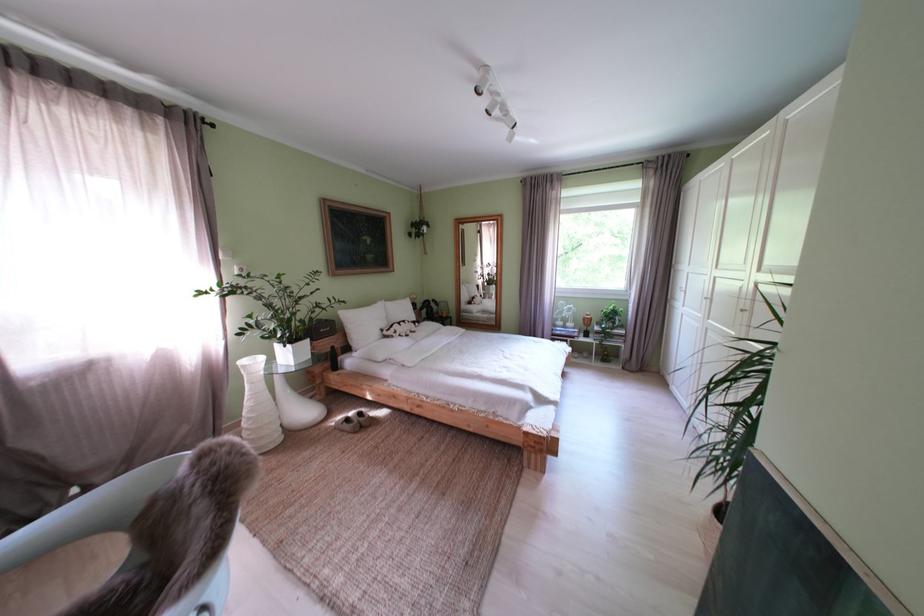
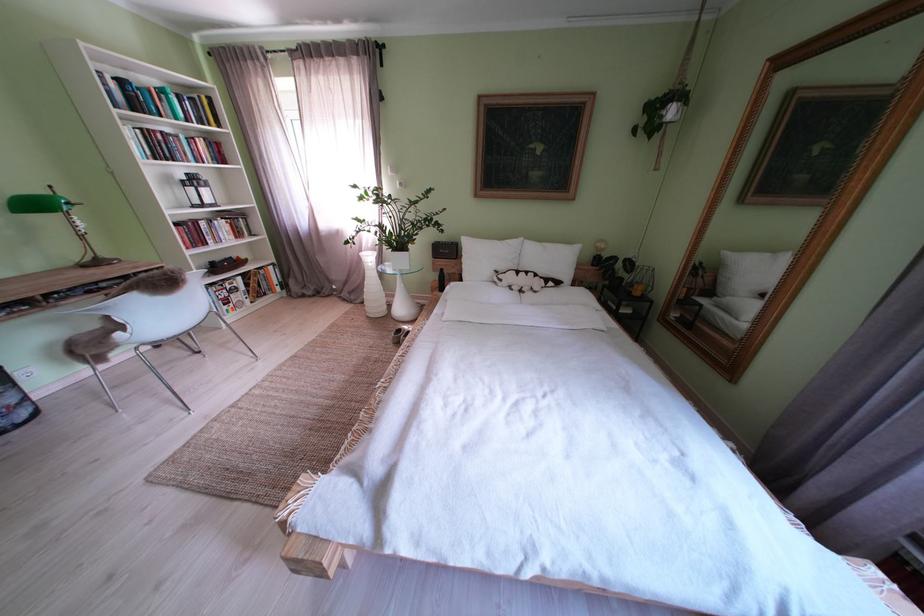
Question: I am providing you with two images of the same scene from different viewpoints. Which of the following objects are not visible in image2?

Choices:
 (A) hanging plant pot
 (B) book on shelf
 (C) black bluetooth speaker
 (D) none of these

Answer: (D)